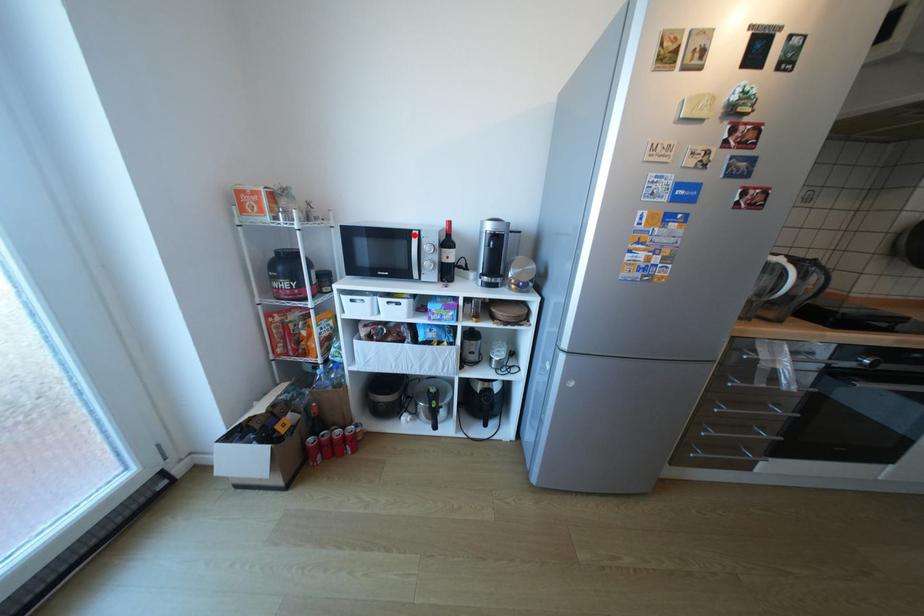
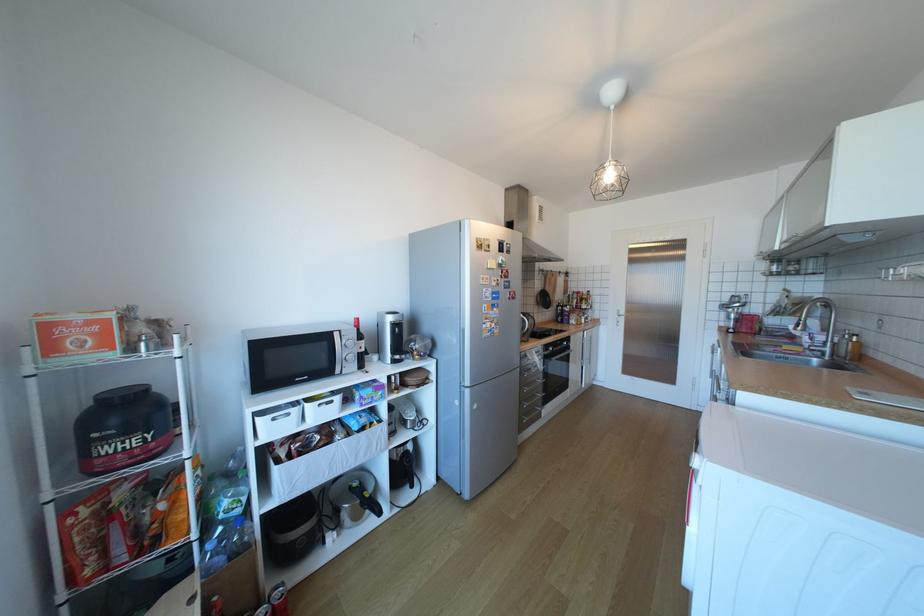
Locate, in the second image, the point that corresponds to the highlighted location in the first image.

(334, 338)